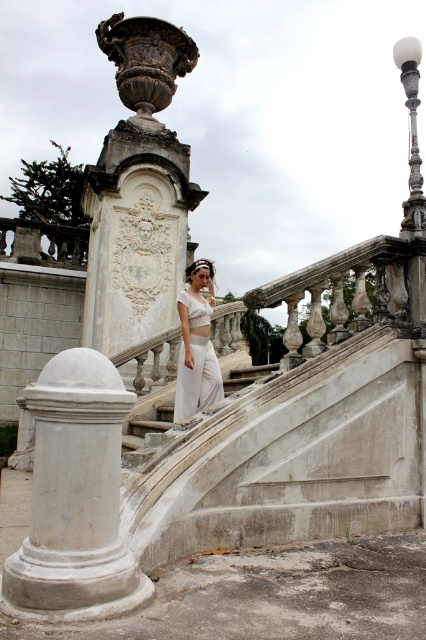
Is white marble column at center bigger than white marble stairs at center?

No.

Between white marble column at center and white marble stairs at center, which one has less height?

white marble stairs at center is shorter.

Who is more forward, (x=48, y=492) or (x=247, y=365)?

Point (x=48, y=492)

Identify the location of white marble column at center. The image size is (426, 640). (75, 499).

Does point (126, 88) come in front of point (213, 285)?

No.

Is point (173, 296) behind point (201, 262)?

Yes, it is.

This screenshot has width=426, height=640. Describe the element at coordinates (138, 189) in the screenshot. I see `white marble vase at upper center` at that location.

I want to click on white marble vase at upper center, so click(x=138, y=189).

Who is more distant from viewer, (157, 260) or (132, 449)?

Point (157, 260)

Does white marble vase at upper center have a smaller size compared to white marble stairs at center?

Incorrect, white marble vase at upper center is not smaller in size than white marble stairs at center.

Is point (184, 33) farther from viewer compared to point (236, 385)?

Yes, it is.

Find the location of a particular element. white marble vase at upper center is located at coordinates (138, 189).